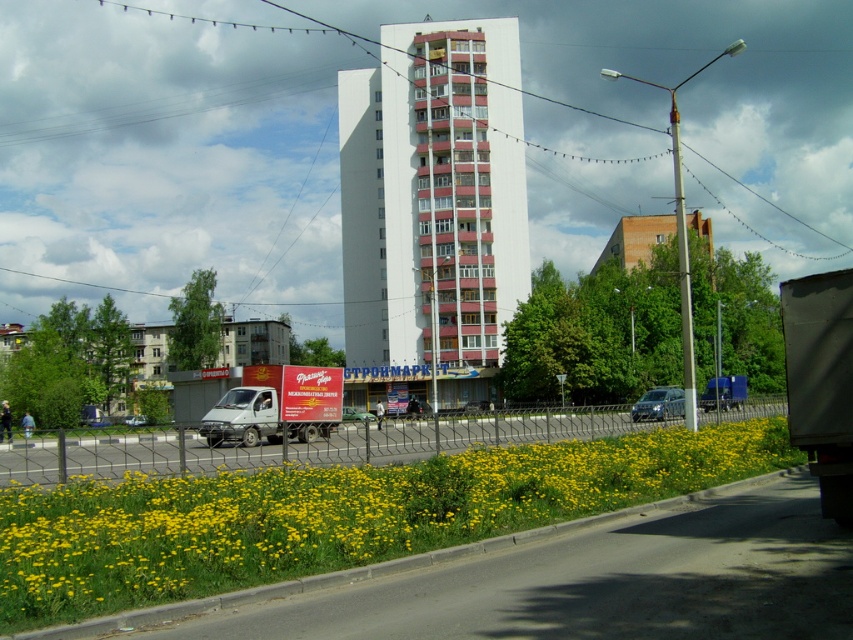
Between blue metallic truck at right and green matte truck at center, which one appears on the right side from the viewer's perspective?

blue metallic truck at right is more to the right.

Does blue metallic truck at right appear under green matte truck at center?

Actually, blue metallic truck at right is above green matte truck at center.

What do you see at coordinates (724, 392) in the screenshot?
I see `blue metallic truck at right` at bounding box center [724, 392].

This screenshot has width=853, height=640. Find the location of `blue metallic truck at right`. blue metallic truck at right is located at coordinates (724, 392).

Can you confirm if blue metallic truck at right is positioned to the right of metallic silver van at center?

Correct, you'll find blue metallic truck at right to the right of metallic silver van at center.

Can you confirm if blue metallic truck at right is shorter than metallic silver van at center?

Incorrect, blue metallic truck at right's height does not fall short of metallic silver van at center's.

Describe the element at coordinates (724, 392) in the screenshot. I see `blue metallic truck at right` at that location.

What are the coordinates of `blue metallic truck at right` in the screenshot? It's located at (724, 392).

Is blue metallic truck at right shorter than silver metallic van at center?

No.

Is point (732, 378) less distant than point (129, 419)?

Yes, point (732, 378) is closer to viewer.

What are the coordinates of `blue metallic truck at right` in the screenshot? It's located at (724, 392).